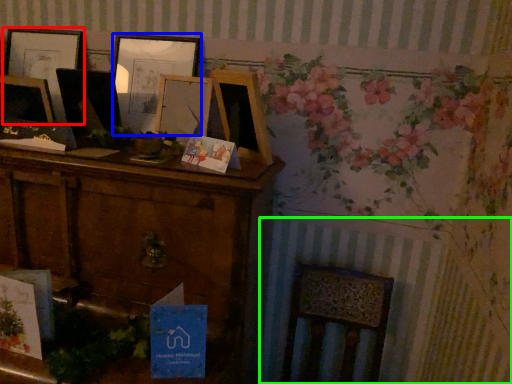
Question: Considering the real-world distances, which object is farthest from picture frame (highlighted by a red box)? picture frame (highlighted by a blue box) or radiator (highlighted by a green box)?

Choices:
 (A) picture frame
 (B) radiator

Answer: (B)